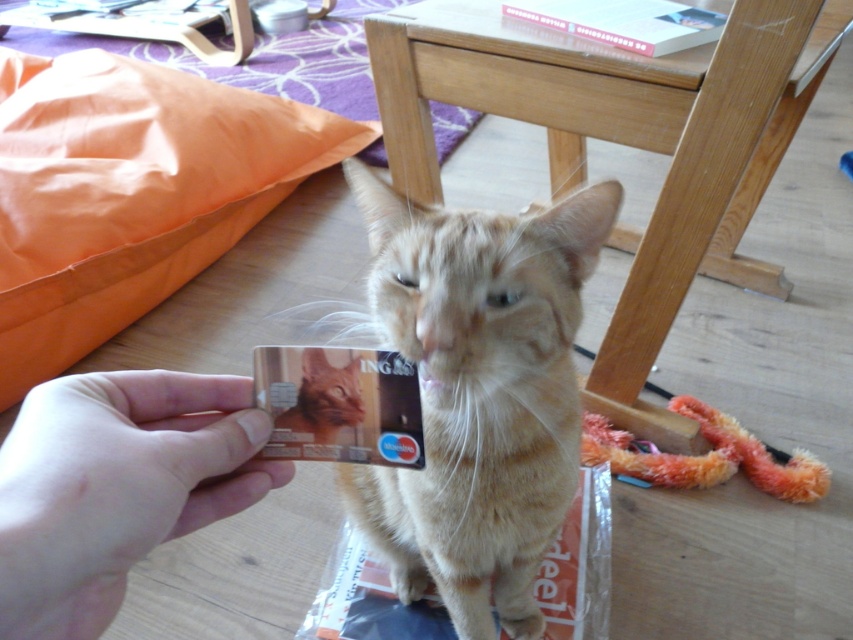
Does wooden stool at center appear under golden fur cat at center?

Incorrect, wooden stool at center is not positioned below golden fur cat at center.

You are a GUI agent. You are given a task and a screenshot of the screen. Output one action in this format:
    pyautogui.click(x=<x>, y=<y>)
    Task: Click on the wooden stool at center
    
    Given the screenshot: What is the action you would take?
    pyautogui.click(x=622, y=144)

Is point (589, 92) positioned after point (315, 442)?

Yes.

Where is `wooden stool at center`? Image resolution: width=853 pixels, height=640 pixels. wooden stool at center is located at coordinates (622, 144).

Between wooden stool at center and light brown fur cat at center, which one appears on the right side from the viewer's perspective?

Positioned to the right is wooden stool at center.

Does wooden stool at center have a smaller size compared to light brown fur cat at center?

No.

Does point (602, 48) lie behind point (572, 365)?

Yes, it is.

Find the location of a particular element. The width and height of the screenshot is (853, 640). wooden stool at center is located at coordinates (622, 144).

Can you confirm if wooden stool at center is bigger than smooth skin hand at lower left?

Indeed, wooden stool at center has a larger size compared to smooth skin hand at lower left.

Between wooden stool at center and smooth skin hand at lower left, which one appears on the right side from the viewer's perspective?

wooden stool at center is more to the right.

What do you see at coordinates (622, 144) in the screenshot?
I see `wooden stool at center` at bounding box center [622, 144].

Locate an element on the screen. The width and height of the screenshot is (853, 640). wooden stool at center is located at coordinates (622, 144).